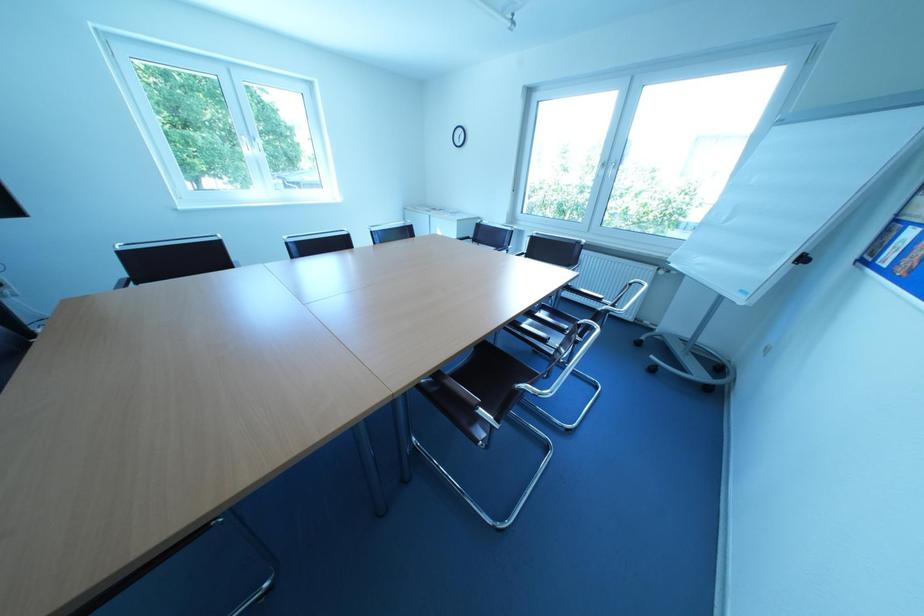
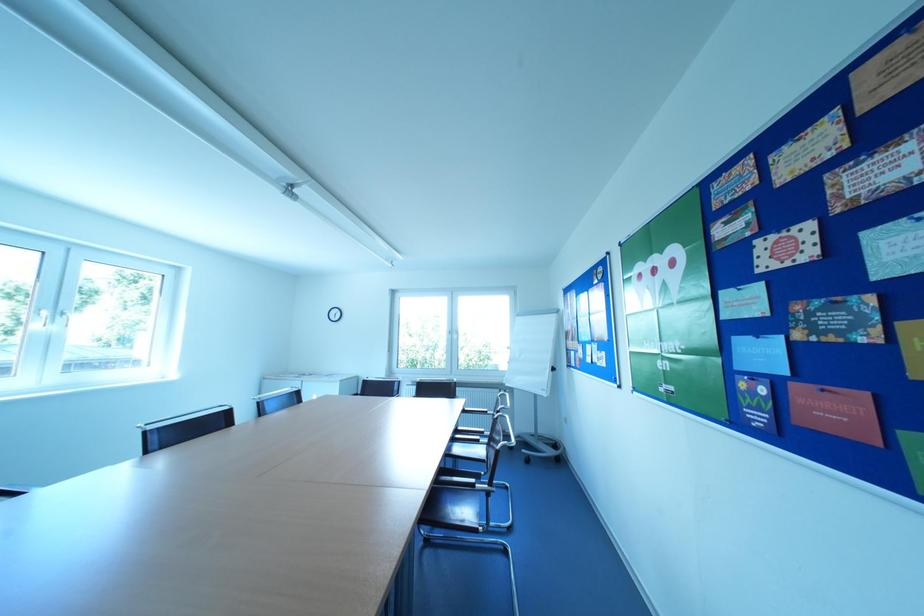
The images are taken continuously from a first-person perspective. In which direction is your viewpoint rotating?

The camera's rotation is toward right-up.